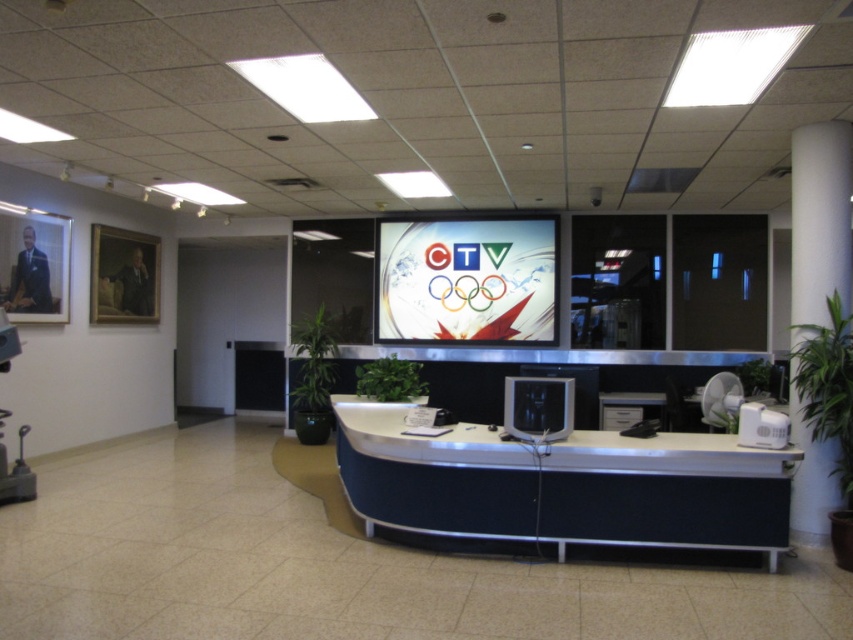
Question: Which is nearer to the metallic silver swivel chair at left?

Choices:
 (A) satin black monitor at center
 (B) white smooth pillar at right
 (C) blue fabric desk at center

Answer: (C)

Question: From the image, what is the correct spatial relationship of blue fabric desk at center in relation to white smooth pillar at right?

Choices:
 (A) right
 (B) left

Answer: (B)

Question: Which point is farther from the camera taking this photo?

Choices:
 (A) (743, 520)
 (B) (10, 355)
 (C) (834, 195)

Answer: (B)

Question: Which object is farther from the camera taking this photo?

Choices:
 (A) satin black monitor at center
 (B) metallic silver swivel chair at left
 (C) white smooth pillar at right

Answer: (B)

Question: Does blue fabric desk at center appear on the left side of metallic silver swivel chair at left?

Choices:
 (A) no
 (B) yes

Answer: (A)

Question: Does white smooth pillar at right appear on the left side of satin black monitor at center?

Choices:
 (A) no
 (B) yes

Answer: (A)